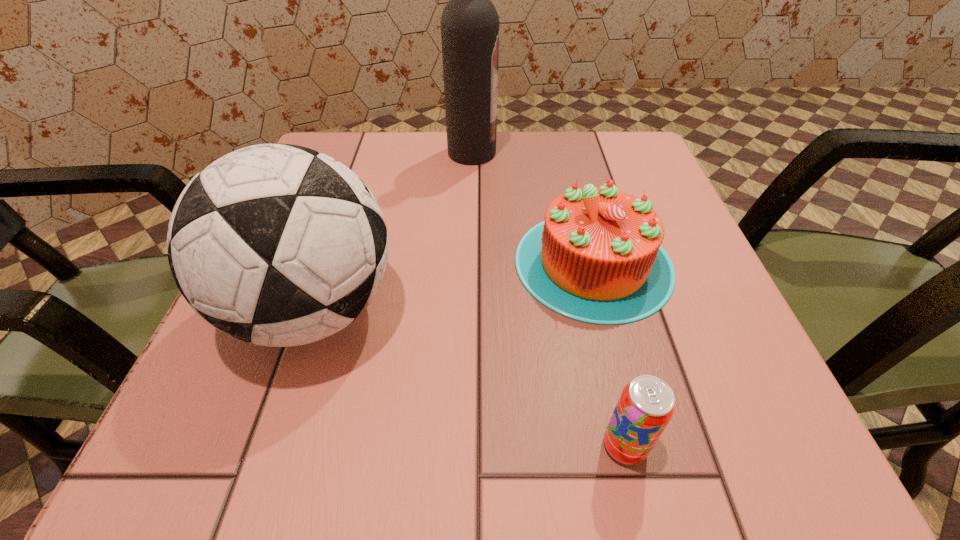
Locate an element on the screen. free space located 0.200m on the left of the nearest object is located at coordinates (431, 446).

I want to click on object at the far edge, so click(x=469, y=22).

Find the location of a particular element. object that is at the near edge is located at coordinates (646, 405).

At what (x,y) coordinates should I click in order to perform the action: click on object present at the left edge. Please return your answer as a coordinate pair (x, y). Image resolution: width=960 pixels, height=540 pixels. Looking at the image, I should click on (276, 244).

I want to click on object present at the right edge, so click(597, 257).

Image resolution: width=960 pixels, height=540 pixels. Find the location of `vacant area at the far edge`. vacant area at the far edge is located at coordinates (572, 161).

Where is `blank space at the near edge`? blank space at the near edge is located at coordinates (375, 440).

You are a GUI agent. You are given a task and a screenshot of the screen. Output one action in this format:
    pyautogui.click(x=<x>, y=<y>)
    Task: Click on the free space at the left edge
    This screenshot has width=960, height=540.
    Given the screenshot: What is the action you would take?
    pyautogui.click(x=240, y=341)

Locate an element on the screen. Image resolution: width=960 pixels, height=540 pixels. vacant space at the right edge of the desktop is located at coordinates (696, 298).

In the image, there is a desktop. Identify the location of vacant space at the far left corner. The image size is (960, 540). (373, 166).